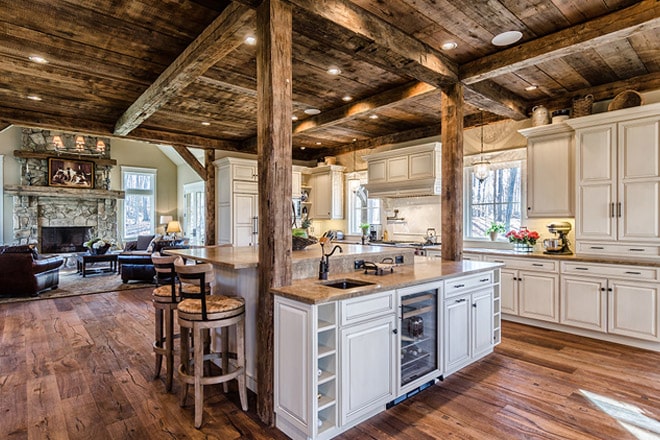
This screenshot has width=660, height=440. I want to click on wooden floor, so click(517, 400), click(106, 330).